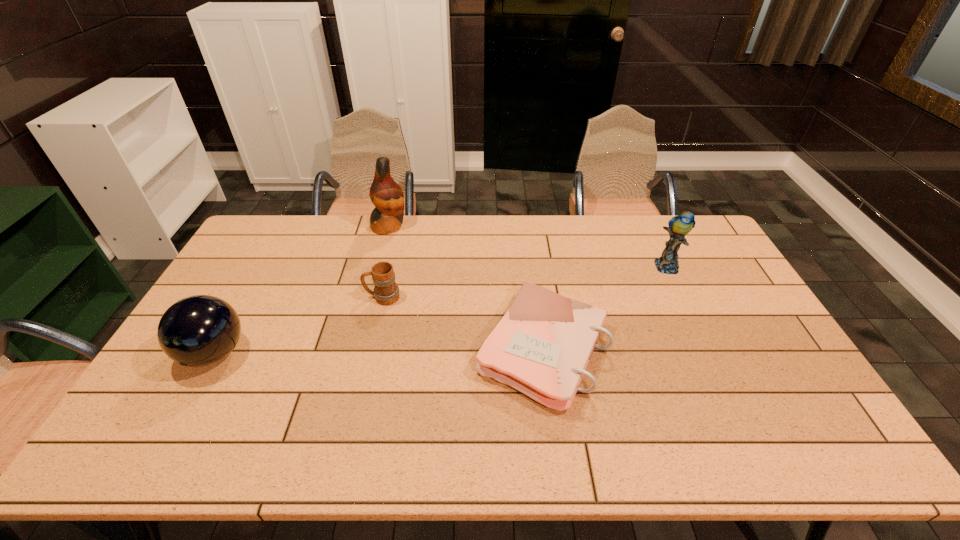
This screenshot has width=960, height=540. What are the coordinates of `vacant space at the right edge of the desktop` in the screenshot? It's located at (696, 277).

The image size is (960, 540). I want to click on blank space at the far left corner of the desktop, so click(x=264, y=247).

At what (x,y) coordinates should I click in order to perform the action: click on vacant region between the fourth tallest object and the right parrot. Please return your answer as a coordinate pair (x, y). Looking at the image, I should click on (524, 282).

This screenshot has height=540, width=960. Find the location of `unoccupied area between the right parrot and the second shortest object`. unoccupied area between the right parrot and the second shortest object is located at coordinates (524, 282).

You are a GUI agent. You are given a task and a screenshot of the screen. Output one action in this format:
    pyautogui.click(x=<x>, y=<y>)
    Task: Click on the free area in between the shortest object and the shorter parrot
    This screenshot has width=960, height=540.
    Given the screenshot: What is the action you would take?
    pyautogui.click(x=605, y=308)

What are the coordinates of `free point between the fourth tallest object and the fourth nearest object` in the screenshot? It's located at (524, 282).

Identify the location of free spot between the rightmost object and the third tallest object. This screenshot has height=540, width=960. (441, 310).

At what (x,y) coordinates should I click in order to perform the action: click on empty space that is in between the mug and the leftmost object. Please return your answer as a coordinate pair (x, y). Image resolution: width=960 pixels, height=540 pixels. Looking at the image, I should click on (299, 325).

I want to click on free space between the shortest object and the bowling ball, so click(378, 351).

The height and width of the screenshot is (540, 960). I want to click on free spot between the leftmost object and the rightmost object, so click(x=441, y=310).